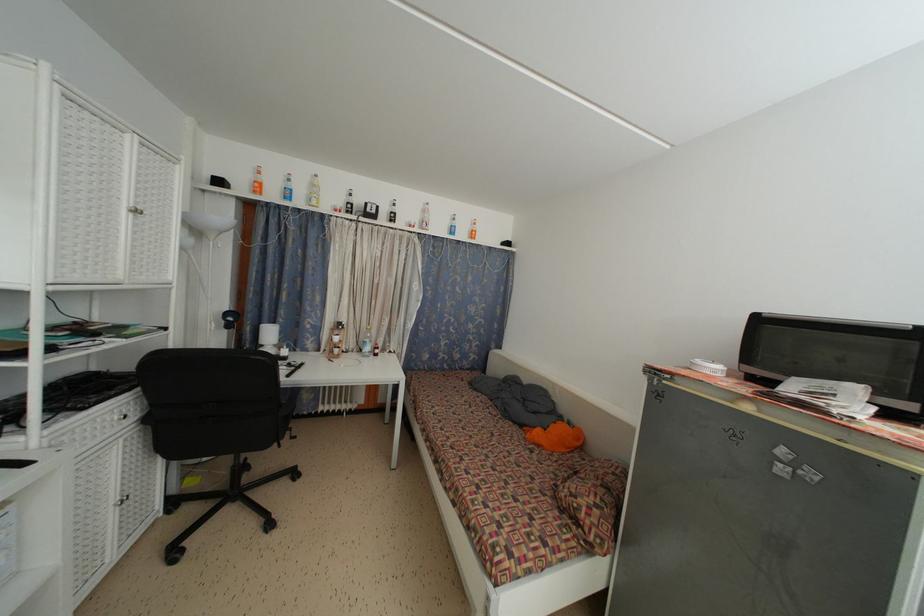
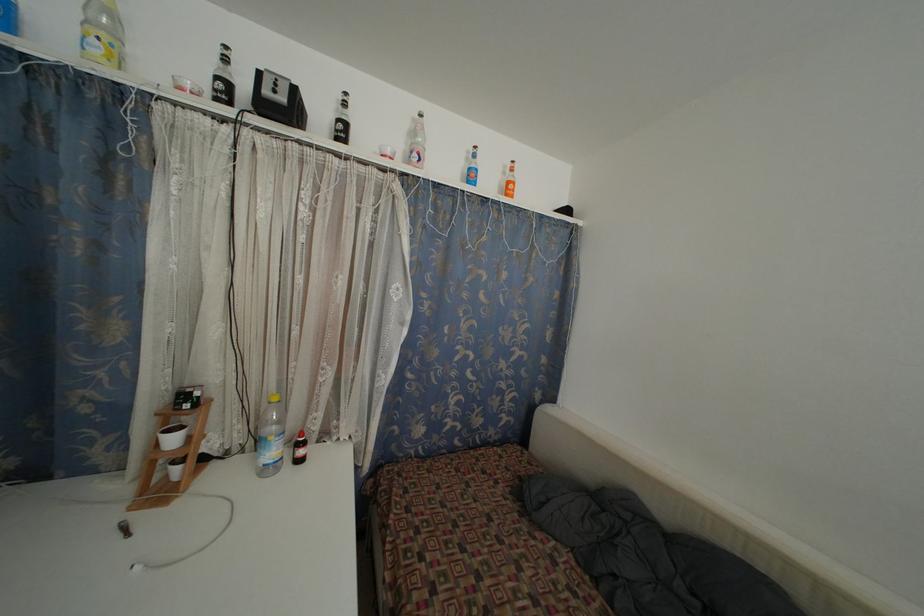
In the second image, find the point that corresponds to pixel 477 237 in the first image.

(513, 188)